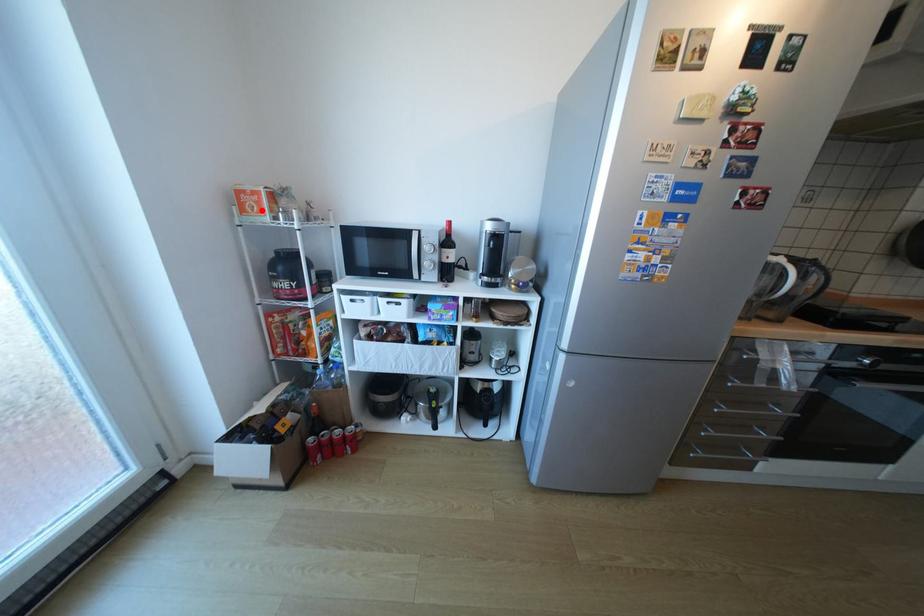
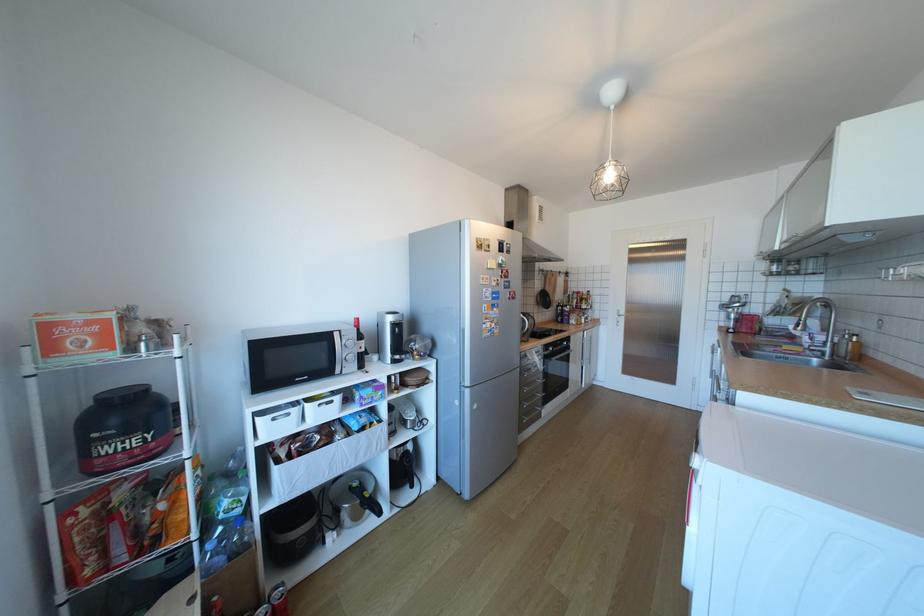
Where in the second image is the point corresponding to the highlighted location from the first image?

(91, 346)